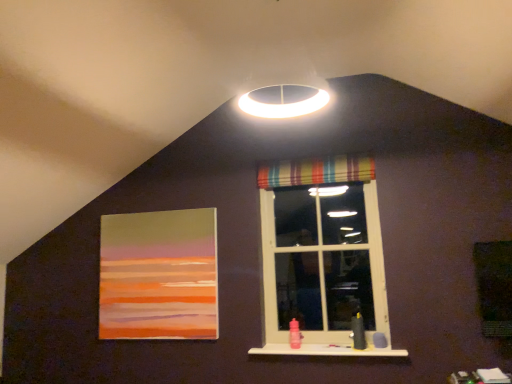
The image size is (512, 384). Describe the element at coordinates (321, 252) in the screenshot. I see `striped fabric window at center` at that location.

Where is `white matte window sill at lower center`? The image size is (512, 384). white matte window sill at lower center is located at coordinates (327, 350).

How different are the orientations of white matte window sill at lower center and striped fabric window at center in degrees?

The facing directions of white matte window sill at lower center and striped fabric window at center are 0.624 degrees apart.

Is white matte window sill at lower center beside striped fabric window at center?

They are not placed beside each other.

Is white matte window sill at lower center aimed at striped fabric window at center?

No, white matte window sill at lower center is not turned towards striped fabric window at center.

Is white matte window sill at lower center outside of striped fabric window at center?

Absolutely, white matte window sill at lower center is external to striped fabric window at center.

Is the surface of striped fabric window at center in direct contact with striped fabric curtain at upper center?

striped fabric window at center and striped fabric curtain at upper center are not in contact.

Which object is closer to the camera, striped fabric window at center or striped fabric curtain at upper center?

striped fabric window at center is more forward.

Considering the relative sizes of striped fabric window at center and striped fabric curtain at upper center in the image provided, is striped fabric window at center bigger than striped fabric curtain at upper center?

Correct, striped fabric window at center is larger in size than striped fabric curtain at upper center.

Is striped fabric window at center oriented towards striped fabric curtain at upper center?

Yes, striped fabric window at center is oriented towards striped fabric curtain at upper center.

Is matte acrylic painting at left to the left or to the right of striped fabric curtain at upper center in the image?

In the image, matte acrylic painting at left appears on the left side of striped fabric curtain at upper center.

Between point (143, 303) and point (301, 179), which one is positioned behind?

Positioned behind is point (143, 303).

Does matte acrylic painting at left contain striped fabric curtain at upper center?

No, striped fabric curtain at upper center is located outside of matte acrylic painting at left.

Considering the sizes of objects matte acrylic painting at left and striped fabric curtain at upper center in the image provided, who is taller, matte acrylic painting at left or striped fabric curtain at upper center?

matte acrylic painting at left.

From the image's perspective, is striped fabric curtain at upper center located above or below striped fabric window at center?

Based on their image positions, striped fabric curtain at upper center is located above striped fabric window at center.

Is striped fabric window at center located within striped fabric curtain at upper center?

No, striped fabric curtain at upper center does not contain striped fabric window at center.

Which point is more distant from viewer, (327, 179) or (317, 240)?

The point (317, 240) is farther from the camera.

Based on the photo, considering their positions, is striped fabric curtain at upper center located in front of or behind striped fabric window at center?

striped fabric curtain at upper center is positioned farther from the viewer than striped fabric window at center.

Considering the positions of objects striped fabric curtain at upper center and white matte window sill at lower center in the image provided, who is more to the right, striped fabric curtain at upper center or white matte window sill at lower center?

From the viewer's perspective, white matte window sill at lower center appears more on the right side.

From the image's perspective, is striped fabric curtain at upper center above white matte window sill at lower center?

Indeed, from the image's perspective, striped fabric curtain at upper center is shown above white matte window sill at lower center.

Does striped fabric curtain at upper center lie behind white matte window sill at lower center?

Yes, it is.

From a real-world perspective, which object stands above the other?

striped fabric curtain at upper center is physically above.

Is striped fabric window at center in contact with matte acrylic painting at left?

striped fabric window at center and matte acrylic painting at left are clearly separated.

From a real-world perspective, between striped fabric window at center and matte acrylic painting at left, who is vertically higher?

striped fabric window at center is physically above.

Which is in front, point (273, 349) or point (134, 311)?

The point (273, 349) is closer.

At what (x,y) coordinates should I click in order to perform the action: click on window above the white matte window sill at lower center (from the image's perspective). Please return your answer as a coordinate pair (x, y). This screenshot has width=512, height=384. Looking at the image, I should click on (321, 252).

Does point (337, 251) lie in front of point (258, 348)?

No, (337, 251) is further to viewer.

Is the surface of striped fabric window at center in direct contact with white matte window sill at lower center?

No, striped fabric window at center is not in contact with white matte window sill at lower center.

Could you tell me if striped fabric window at center is turned towards white matte window sill at lower center?

Yes, striped fabric window at center is facing white matte window sill at lower center.

Where is `window sill located in front of the striped fabric window at center`? This screenshot has width=512, height=384. window sill located in front of the striped fabric window at center is located at coordinates (327, 350).

Where is `curtain that is above the striped fabric window at center (from the image's perspective)`? This screenshot has height=384, width=512. curtain that is above the striped fabric window at center (from the image's perspective) is located at coordinates (316, 171).

Estimate the real-world distances between objects in this image. Which object is further from white matte window sill at lower center, striped fabric window at center or matte acrylic painting at left?

matte acrylic painting at left lies further to white matte window sill at lower center than the other object.

Estimate the real-world distances between objects in this image. Which object is further from matte acrylic painting at left, striped fabric window at center or striped fabric curtain at upper center?

Based on the image, striped fabric curtain at upper center appears to be further to matte acrylic painting at left.

From the image, which object appears to be nearer to striped fabric window at center, striped fabric curtain at upper center or white matte window sill at lower center?

striped fabric curtain at upper center is positioned closer to the anchor striped fabric window at center.

Considering their positions, is striped fabric window at center positioned further to striped fabric curtain at upper center than white matte window sill at lower center?

Among the two, white matte window sill at lower center is located further to striped fabric curtain at upper center.

Consider the image. Considering their positions, is matte acrylic painting at left positioned further to striped fabric window at center than white matte window sill at lower center?

matte acrylic painting at left is positioned further to the anchor striped fabric window at center.

Looking at the image, which one is located further to matte acrylic painting at left, striped fabric curtain at upper center or striped fabric window at center?

Among the two, striped fabric curtain at upper center is located further to matte acrylic painting at left.

From the image, which object appears to be farther from matte acrylic painting at left, striped fabric curtain at upper center or white matte window sill at lower center?

Based on the image, striped fabric curtain at upper center appears to be further to matte acrylic painting at left.

Based on their spatial positions, is white matte window sill at lower center or striped fabric window at center closer to matte acrylic painting at left?

Based on the image, striped fabric window at center appears to be nearer to matte acrylic painting at left.

This screenshot has width=512, height=384. In order to click on window sill between matte acrylic painting at left and striped fabric window at center in the horizontal direction in this screenshot , I will do `click(327, 350)`.

The width and height of the screenshot is (512, 384). Find the location of `window that lies between striped fabric curtain at upper center and white matte window sill at lower center from top to bottom`. window that lies between striped fabric curtain at upper center and white matte window sill at lower center from top to bottom is located at coordinates (321, 252).

The width and height of the screenshot is (512, 384). I want to click on curtain located between matte acrylic painting at left and striped fabric window at center in the left-right direction, so click(316, 171).

Where is `curtain between matte acrylic painting at left and white matte window sill at lower center`? curtain between matte acrylic painting at left and white matte window sill at lower center is located at coordinates (316, 171).